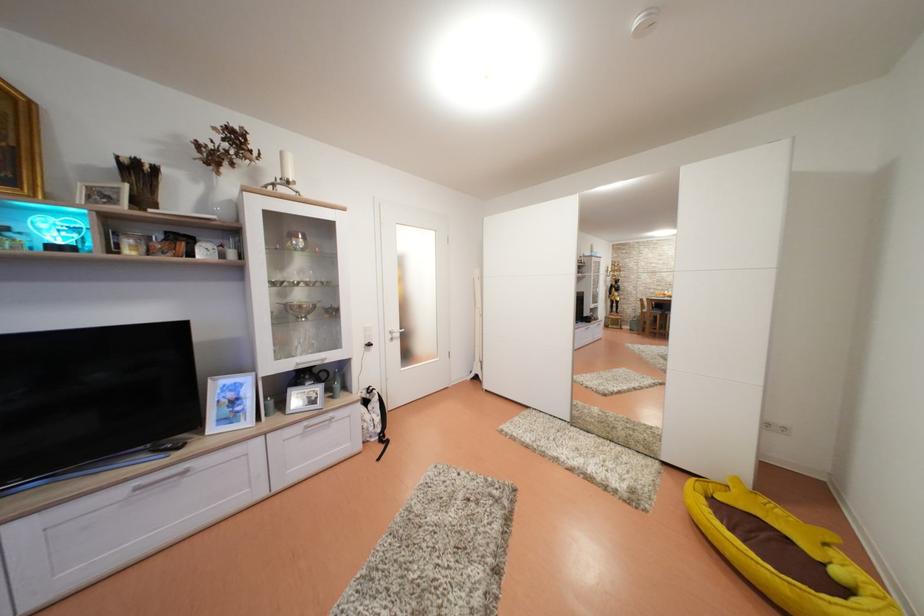
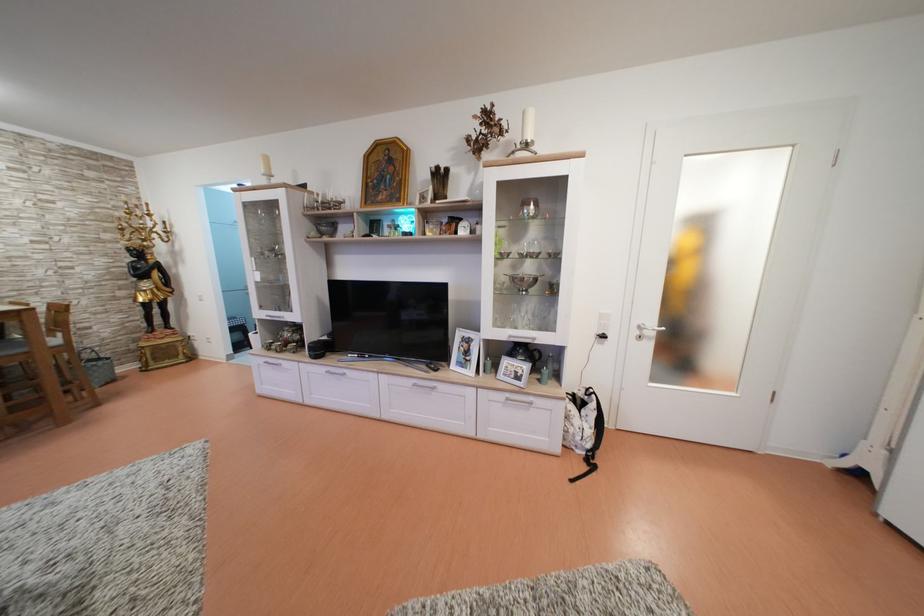
Where in the second image is the point corresponding to (x=314, y=382) from the first image?

(528, 357)